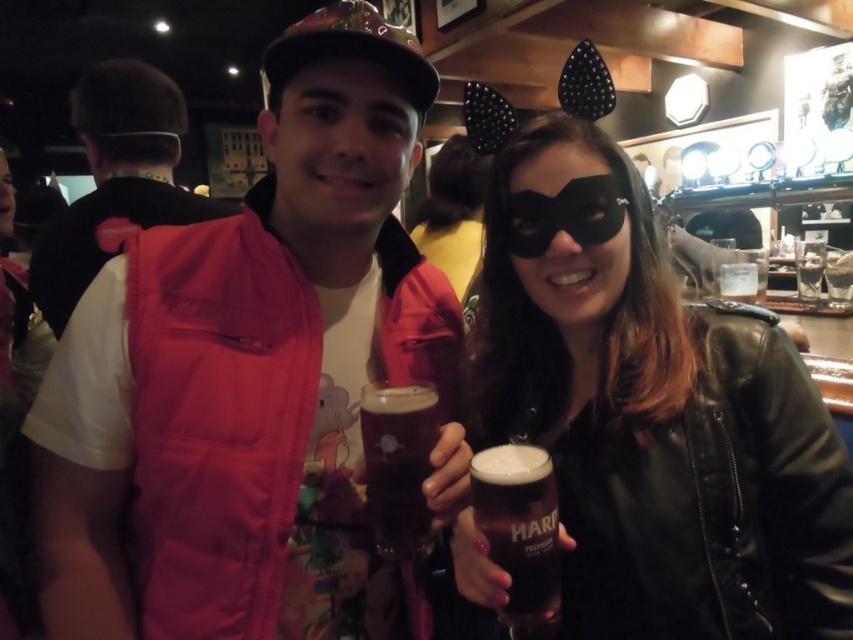
Question: Which point is closer to the camera?

Choices:
 (A) black leather mask at center
 (B) dark amber glass at center
 (C) pink fleece vest at left

Answer: (A)

Question: Can you confirm if pink fabric vest at center is bigger than clear glass at upper right?

Choices:
 (A) yes
 (B) no

Answer: (A)

Question: Is pink fabric vest at center closer to the viewer compared to dark brown glass at center?

Choices:
 (A) yes
 (B) no

Answer: (B)

Question: Which object appears closest to the camera in this image?

Choices:
 (A) pink fleece vest at left
 (B) black leather mask at center

Answer: (B)

Question: Is black leather mask at center above dark amber glass at center?

Choices:
 (A) yes
 (B) no

Answer: (A)

Question: Which point is farther from the camera taking this photo?

Choices:
 (A) (80, 225)
 (B) (514, 480)

Answer: (A)